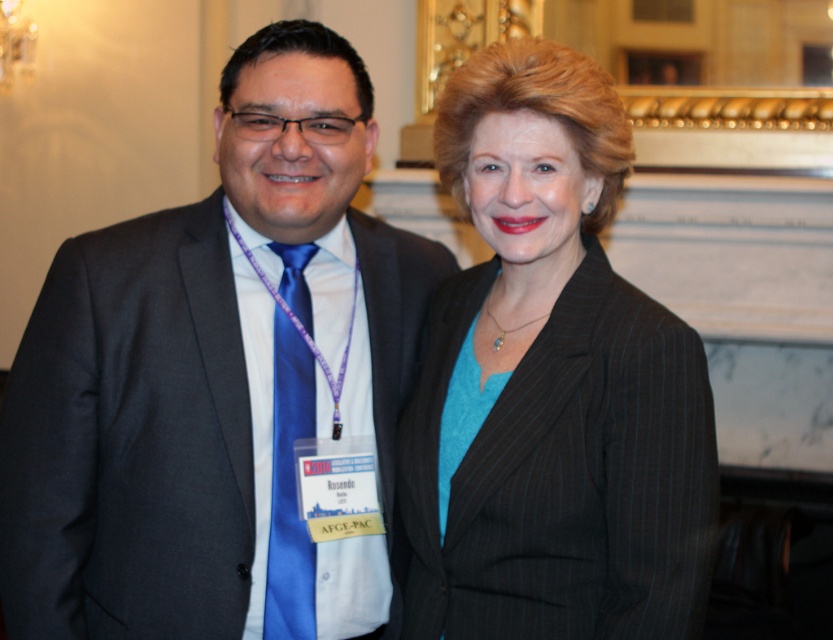
Is matte black suit at center further to the viewer compared to matte black blazer at center?

That is True.

Which of these two, matte black suit at center or matte black blazer at center, stands taller?

matte black suit at center is taller.

Does point (257, 609) come behind point (499, 288)?

That is False.

The image size is (833, 640). I want to click on matte black suit at center, so click(215, 381).

Is matte black suit at center wider than blue silk tie at left?

Yes, matte black suit at center is wider than blue silk tie at left.

Is matte black suit at center positioned behind blue silk tie at left?

No, it is in front of blue silk tie at left.

Is point (278, 442) positioned behind point (302, 596)?

Yes, point (278, 442) is farther from viewer.

Where is `matte black suit at center`? matte black suit at center is located at coordinates (215, 381).

Is the position of matte black blazer at center more distant than that of blue silk tie at left?

No, matte black blazer at center is closer to the viewer.

Is matte black blazer at center positioned in front of blue silk tie at left?

Yes, matte black blazer at center is closer to the viewer.

Is point (550, 602) positioned before point (285, 476)?

Yes.

Identify the location of matte black blazer at center. The height and width of the screenshot is (640, 833). (551, 385).